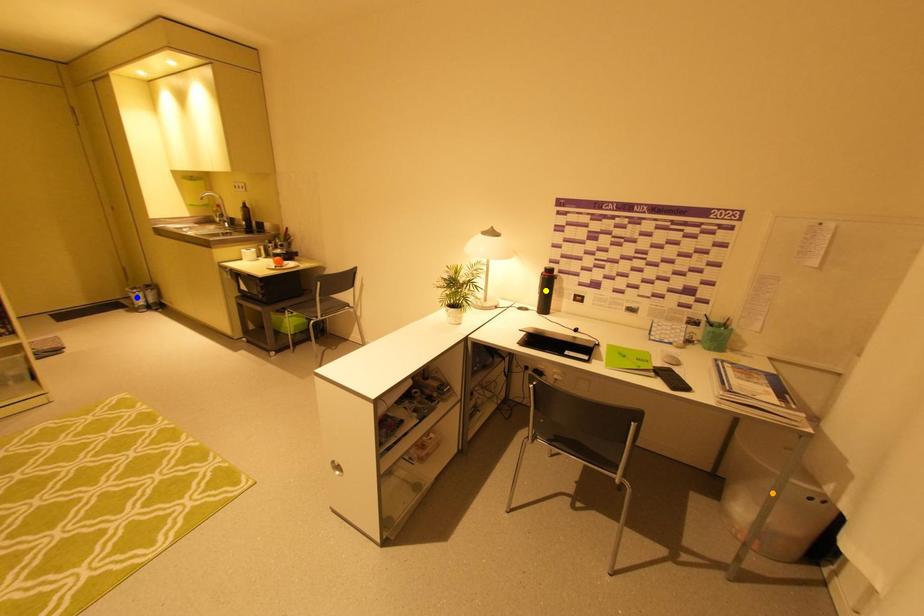
Order these from farthest to nearest:
- blue point
- orange point
- yellow point

blue point < yellow point < orange point